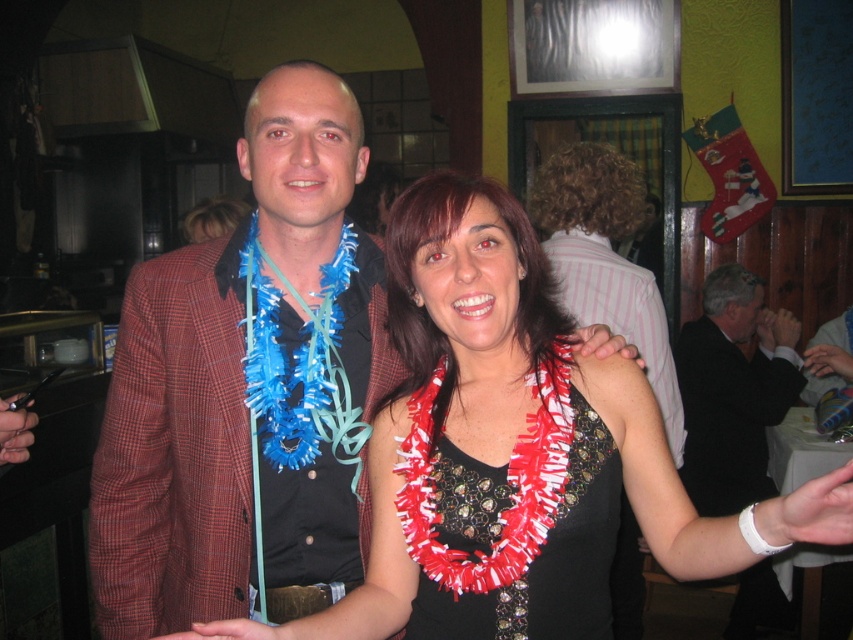
Question: Is plaid fabric jacket at center to the right of black leather jacket at upper right from the viewer's perspective?

Choices:
 (A) yes
 (B) no

Answer: (B)

Question: Based on their relative distances, which object is farther from the black sequined dress at center?

Choices:
 (A) black leather jacket at upper right
 (B) matte blue lei at center
 (C) plaid fabric jacket at center

Answer: (A)

Question: Does black sequined dress at center appear under matte blue lei at center?

Choices:
 (A) no
 (B) yes

Answer: (B)

Question: Which of these objects is positioned farthest from the plaid fabric jacket at center?

Choices:
 (A) matte blue lei at center
 (B) black leather jacket at upper right
 (C) red fringed lei at center
 (D) black sequined dress at center

Answer: (B)

Question: Which object is closer to the camera taking this photo?

Choices:
 (A) black leather jacket at upper right
 (B) black sequined dress at center

Answer: (B)

Question: Is plaid fabric jacket at center further to camera compared to black sequined dress at center?

Choices:
 (A) yes
 (B) no

Answer: (A)